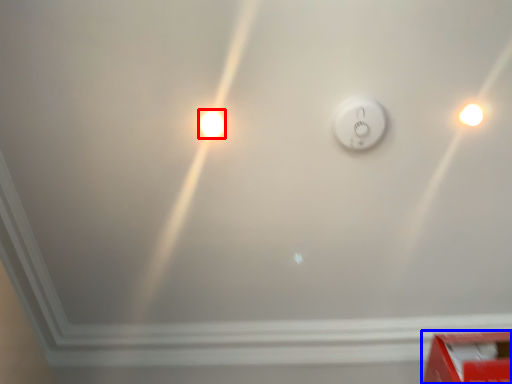
Question: Which of the following is the closest to the observer, light bulb (highlighted by a red box) or box (highlighted by a blue box)?

Choices:
 (A) light bulb
 (B) box

Answer: (B)